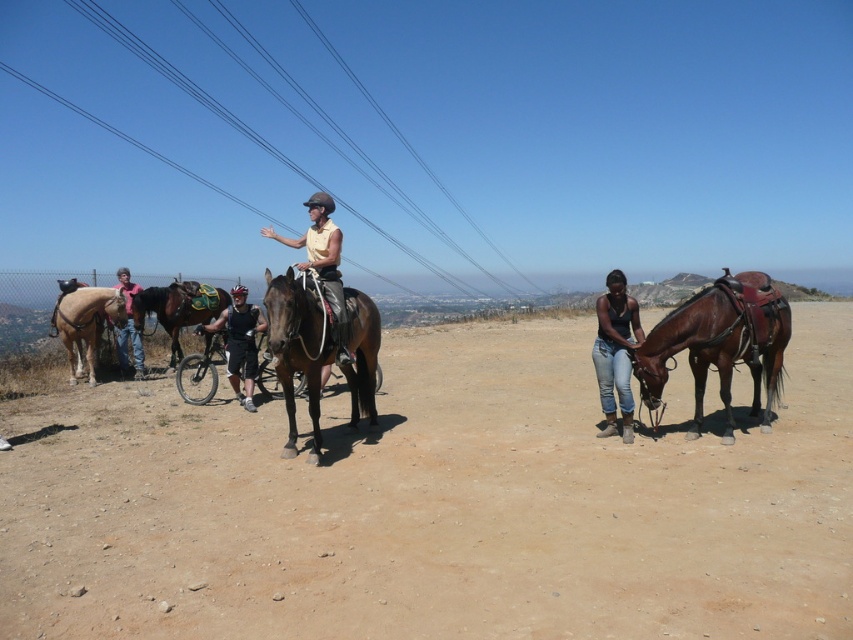
Question: Which point appears farthest from the camera in this image?

Choices:
 (A) (700, 324)
 (B) (279, 348)

Answer: (A)

Question: Which of these objects is positioned farthest from the light brown leather horse at left?

Choices:
 (A) brown leather horse at right
 (B) brown glossy horse at center

Answer: (A)

Question: Can you confirm if matte yellow shirt at center is thinner than light brown leather jacket at left?

Choices:
 (A) yes
 (B) no

Answer: (A)

Question: Can you confirm if brown leather horse at right is positioned to the right of brown leather horse at center?

Choices:
 (A) yes
 (B) no

Answer: (A)

Question: Which point is farther to the camera?

Choices:
 (A) light brown leather jacket at left
 (B) brown leather horse at center
 (C) brown sandy dirt at center
 (D) matte yellow shirt at center

Answer: (B)

Question: Where is brown sandy dirt at center located in relation to dark gray fabric shirt at center in the image?

Choices:
 (A) right
 (B) left

Answer: (A)